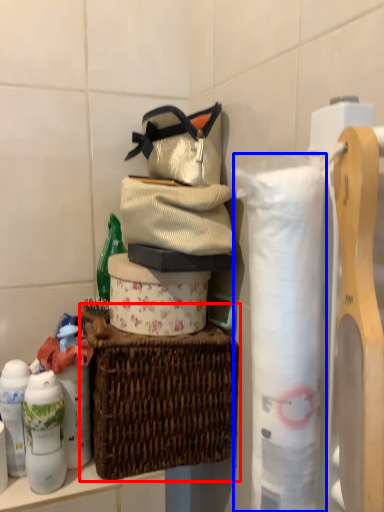
Question: Which of the following is the farthest to the observer, picnic basket (highlighted by a red box) or toilet paper (highlighted by a blue box)?

Choices:
 (A) picnic basket
 (B) toilet paper

Answer: (A)